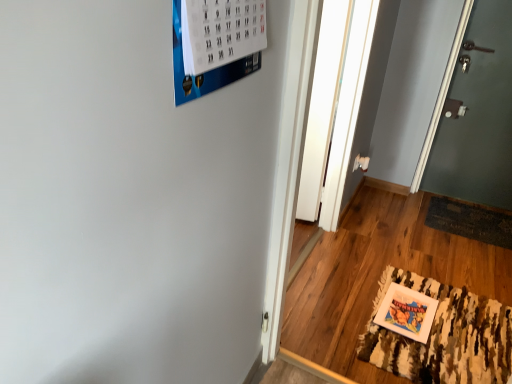
Question: Can you confirm if camouflage-patterned rug at lower right is thinner than green matte door at right?

Choices:
 (A) yes
 (B) no

Answer: (B)

Question: Is green matte door at right at the back of camouflage-patterned rug at lower right?

Choices:
 (A) no
 (B) yes

Answer: (B)

Question: Is camouflage-patterned rug at lower right bigger than green matte door at right?

Choices:
 (A) yes
 (B) no

Answer: (B)

Question: From the image's perspective, is camouflage-patterned rug at lower right below green matte door at right?

Choices:
 (A) no
 (B) yes

Answer: (B)

Question: Does camouflage-patterned rug at lower right appear on the right side of green matte door at right?

Choices:
 (A) yes
 (B) no

Answer: (B)

Question: Is camouflage-patterned rug at lower right closer to camera compared to green matte door at right?

Choices:
 (A) yes
 (B) no

Answer: (A)

Question: Does dark brown woven mat at lower right have a larger size compared to green matte door at right?

Choices:
 (A) no
 (B) yes

Answer: (A)

Question: Is dark brown woven mat at lower right not inside green matte door at right?

Choices:
 (A) yes
 (B) no

Answer: (A)

Question: Would you say dark brown woven mat at lower right is a long distance from green matte door at right?

Choices:
 (A) no
 (B) yes

Answer: (A)

Question: Are dark brown woven mat at lower right and green matte door at right beside each other?

Choices:
 (A) yes
 (B) no

Answer: (B)

Question: Does dark brown woven mat at lower right have a lesser width compared to green matte door at right?

Choices:
 (A) yes
 (B) no

Answer: (B)

Question: Is dark brown woven mat at lower right to the left of green matte door at right from the viewer's perspective?

Choices:
 (A) yes
 (B) no

Answer: (A)

Question: Considering the relative sizes of white matte picture frame at lower right and transparent glass door at center in the image provided, is white matte picture frame at lower right shorter than transparent glass door at center?

Choices:
 (A) no
 (B) yes

Answer: (B)